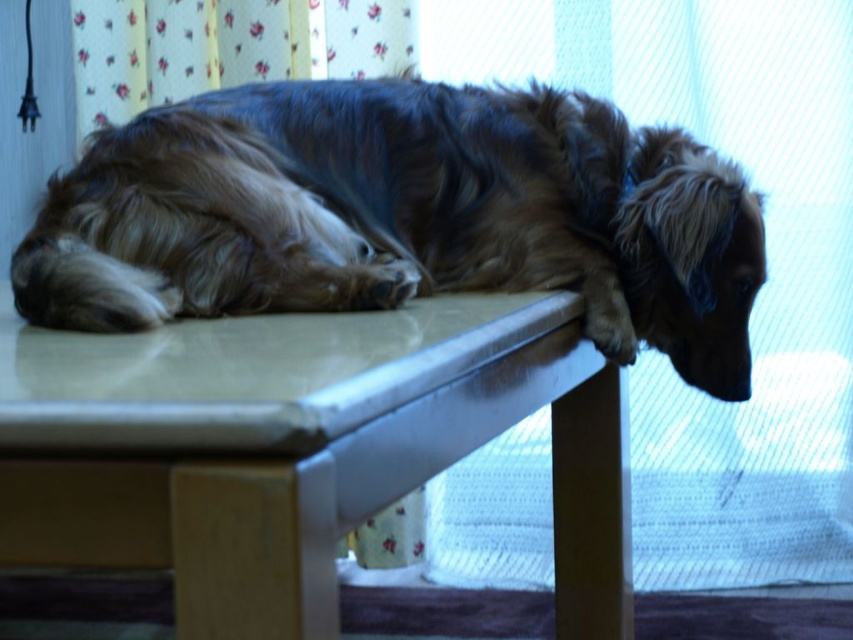
Between point (573, 618) and point (115, 86), which one is positioned in front?

Point (573, 618) is more forward.

Is point (398, 429) behind point (399, 72)?

No, it is in front of (399, 72).

Is point (398, 388) less distant than point (73, 36)?

Yes, it is in front of point (73, 36).

The width and height of the screenshot is (853, 640). In order to click on smooth beige table at center in this screenshot , I will do `click(302, 449)`.

Which is more to the right, brown shaggy dog at upper center or floral fabric curtain at upper center?

Positioned to the right is brown shaggy dog at upper center.

Does point (722, 220) lie in front of point (227, 8)?

Yes.

In order to click on brown shaggy dog at upper center in this screenshot , I will do `click(402, 216)`.

Between brown shaggy dog at upper center and smooth beige table at center, which one has less height?

With less height is brown shaggy dog at upper center.

Is brown shaggy dog at upper center bigger than smooth beige table at center?

No, brown shaggy dog at upper center is not bigger than smooth beige table at center.

Between point (566, 276) and point (628, 492), which one is positioned behind?

The point (628, 492) is behind.

Identify the location of brown shaggy dog at upper center. (402, 216).